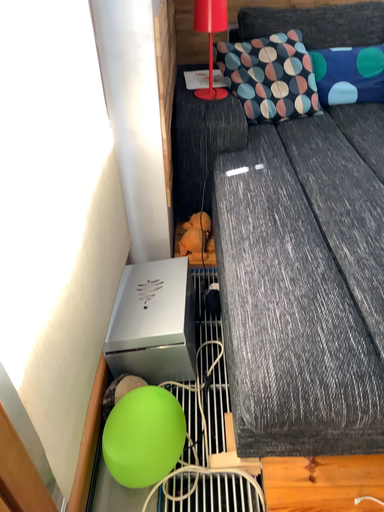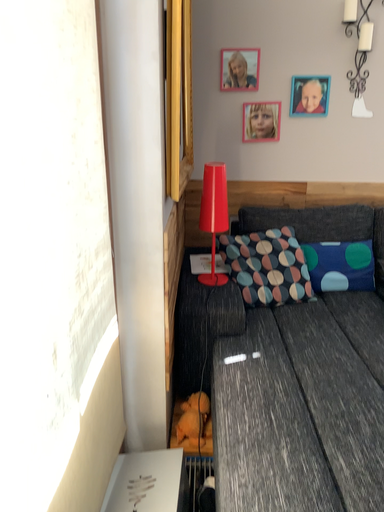
Question: Which way did the camera rotate in the video?

Choices:
 (A) rotated upward
 (B) rotated downward

Answer: (A)